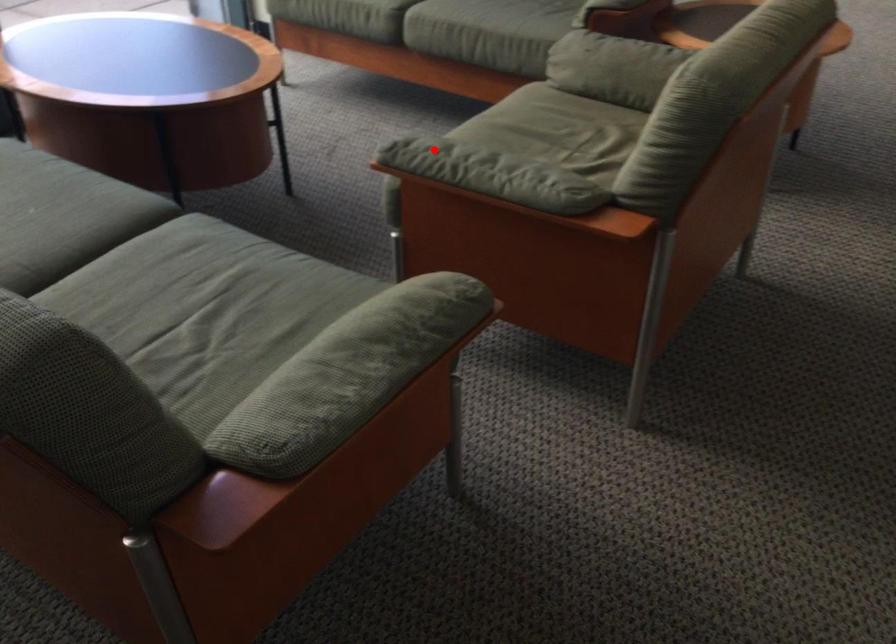
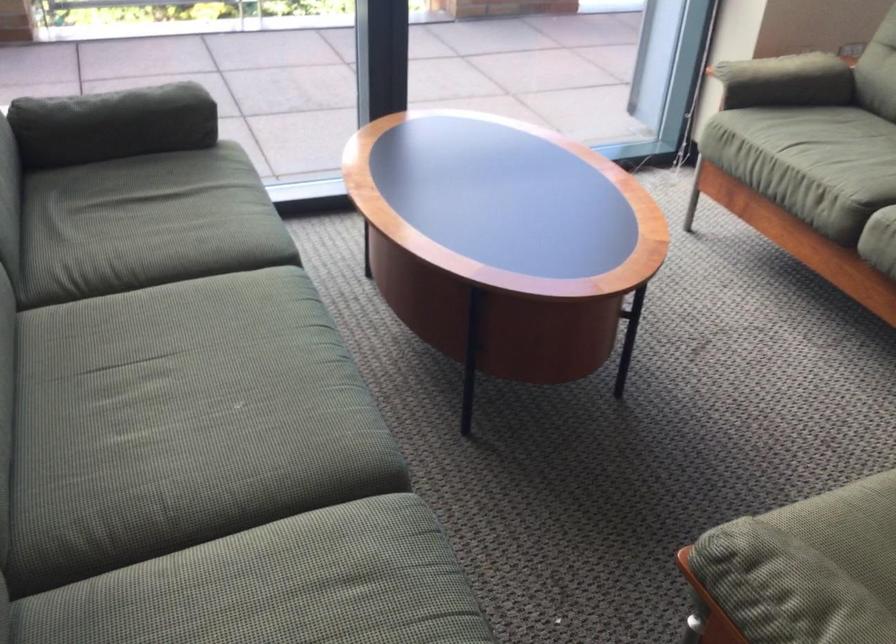
Question: A red point is marked in image1. In image2, is the corresponding 3D point closer to the camera or farther? Reply with the corresponding letter.

Choices:
 (A) The corresponding 3D point is closer.
 (B) The corresponding 3D point is farther.

Answer: (A)